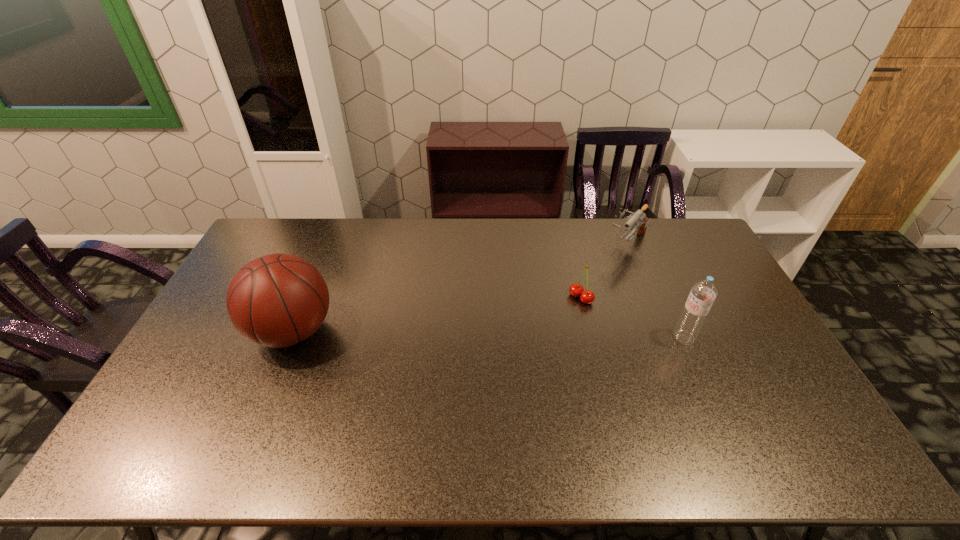
Locate an element on the screen. The height and width of the screenshot is (540, 960). the leftmost object is located at coordinates (278, 300).

Where is `water bottle`? This screenshot has height=540, width=960. water bottle is located at coordinates (703, 293).

Image resolution: width=960 pixels, height=540 pixels. I want to click on cherry, so click(586, 296).

I want to click on the shortest object, so click(x=586, y=296).

I want to click on the second shortest object, so (638, 218).

At what (x,y) coordinates should I click in order to perform the action: click on gun. Please return your answer as a coordinate pair (x, y). The width and height of the screenshot is (960, 540). Looking at the image, I should click on (638, 218).

Identify the location of vacant area situated on the right of the basketball. (386, 331).

The width and height of the screenshot is (960, 540). I want to click on free region located 0.220m on the front of the water bottle, so click(717, 413).

Identify the location of free space located 0.230m with the stems of the shortest object pointing upwards. This screenshot has height=540, width=960. (528, 343).

The width and height of the screenshot is (960, 540). In order to click on free space located 0.340m with the stems of the shortest object pointing upwards in this screenshot , I will do `click(503, 365)`.